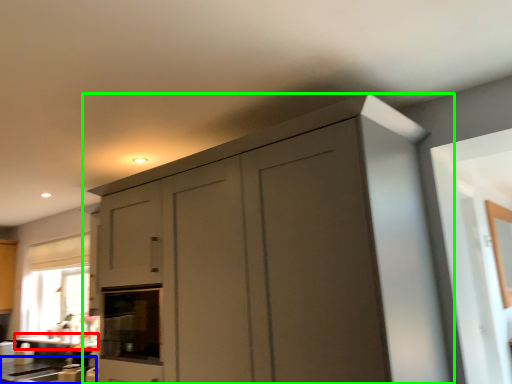
Question: Which object is positioned farthest from counter top (highlighted by a red box)? Select from counter top (highlighted by a blue box) and cupboard (highlighted by a green box).

Choices:
 (A) counter top
 (B) cupboard

Answer: (B)